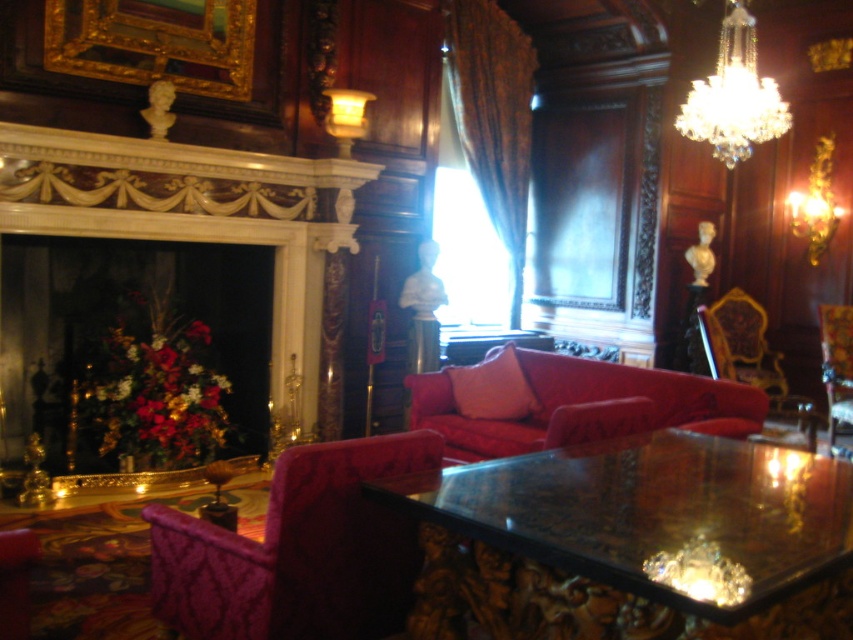
Is clear crystal chandelier at upper right positioned before gold ornate chair at right?

Yes, clear crystal chandelier at upper right is in front of gold ornate chair at right.

Does point (711, 115) lie behind point (718, 364)?

No, (711, 115) is in front of (718, 364).

The width and height of the screenshot is (853, 640). Describe the element at coordinates (733, 96) in the screenshot. I see `clear crystal chandelier at upper right` at that location.

At what (x,y) coordinates should I click in order to perform the action: click on clear crystal chandelier at upper right. Please return your answer as a coordinate pair (x, y). The image size is (853, 640). Looking at the image, I should click on (733, 96).

Between shiny glass table at center and velvet purple chair at lower left, which one is positioned higher?

shiny glass table at center is above.

Who is lower down, shiny glass table at center or velvet purple chair at lower left?

Positioned lower is velvet purple chair at lower left.

Is point (762, 612) positioned after point (300, 492)?

That is False.

You are a GUI agent. You are given a task and a screenshot of the screen. Output one action in this format:
    pyautogui.click(x=<x>, y=<y>)
    Task: Click on the shiny glass table at center
    
    Given the screenshot: What is the action you would take?
    pyautogui.click(x=630, y=540)

Image resolution: width=853 pixels, height=640 pixels. Find the location of `shiny glass table at center`. shiny glass table at center is located at coordinates (x=630, y=540).

What are the coordinates of `shiny glass table at center` in the screenshot? It's located at (630, 540).